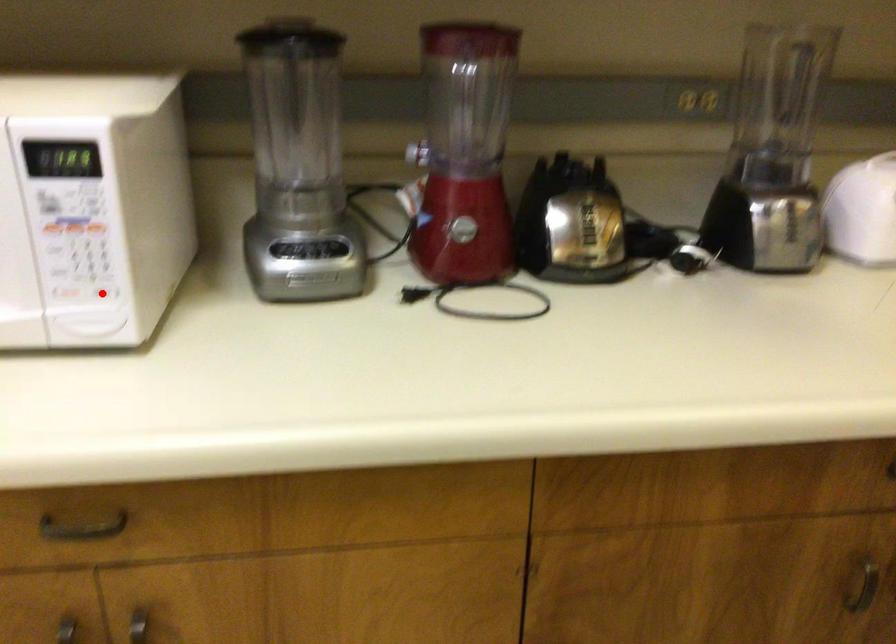
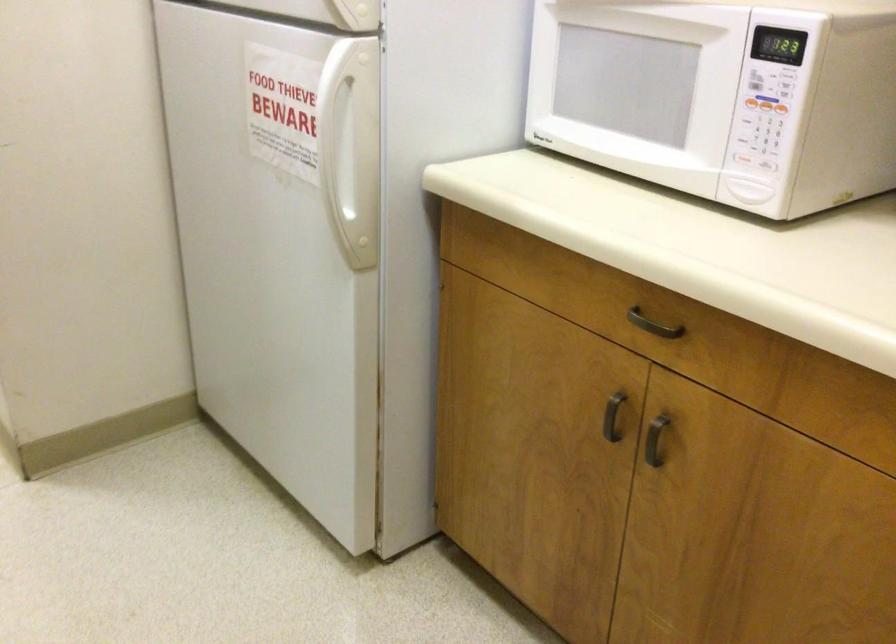
Question: A red point is marked in image1. In image2, is the corresponding 3D point closer to the camera or farther? Reply with the corresponding letter.

Choices:
 (A) The corresponding 3D point is closer.
 (B) The corresponding 3D point is farther.

Answer: (B)